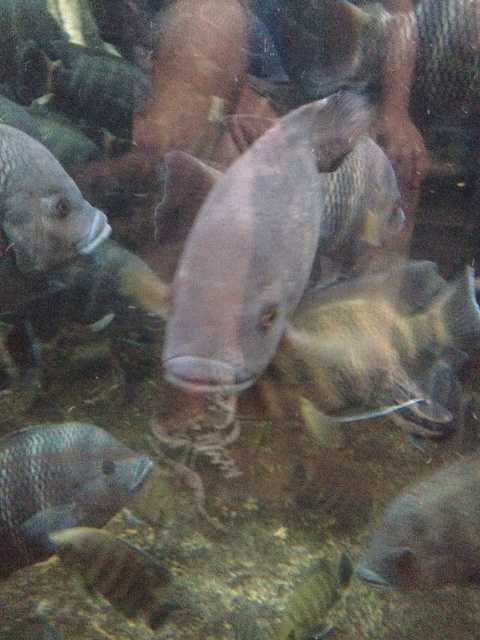
Question: Is shiny silver fish at lower left positioned in front of brown striped rock at lower left?

Choices:
 (A) yes
 (B) no

Answer: (A)

Question: Estimate the real-world distances between objects in this image. Which object is farther from the brown striped rock at lower left?

Choices:
 (A) shiny silver fish at center
 (B) matte silver fish at upper left
 (C) smooth gray fish at center
 (D) shiny silver fish at lower left

Answer: (C)

Question: Is smooth gray fish at lower right below shiny silver fish at center?

Choices:
 (A) yes
 (B) no

Answer: (B)

Question: Estimate the real-world distances between objects in this image. Which object is farther from the smooth gray fish at lower right?

Choices:
 (A) smooth gray fish at center
 (B) satin silver fish at center

Answer: (A)

Question: Can you confirm if shiny silver fish at lower left is positioned to the left of shiny silver fish at center?

Choices:
 (A) no
 (B) yes

Answer: (B)

Question: Which of the following is the closest to the observer?

Choices:
 (A) smooth gray fish at lower right
 (B) satin silver fish at center
 (C) shiny silver fish at center
 (D) shiny silver fish at lower left

Answer: (B)